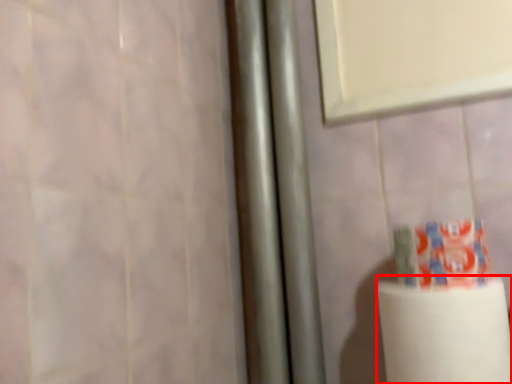
Question: Observing the image, what is the correct spatial positioning of paper towel (annotated by the red box) in reference to toothpaste?

Choices:
 (A) left
 (B) right

Answer: (A)